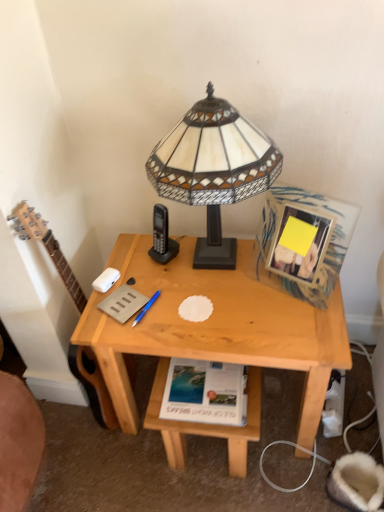
The image size is (384, 512). Identify the location of vacant area to the left of natural wood table at lower center. (127, 463).